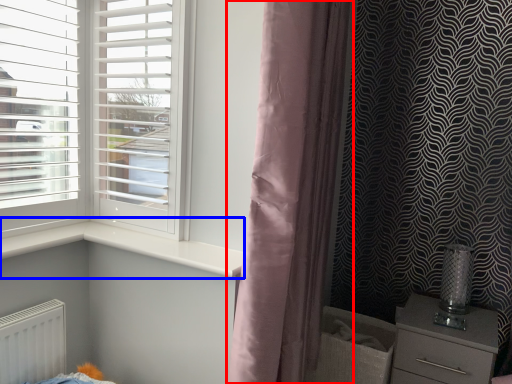
Question: Which object appears closest to the camera in this image, curtain (highlighted by a red box) or window sill (highlighted by a blue box)?

Choices:
 (A) curtain
 (B) window sill

Answer: (A)